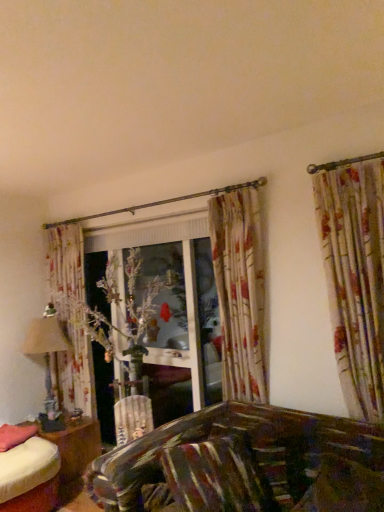
Question: Is wooden table at lower left not within matte beige lampshade at left?

Choices:
 (A) yes
 (B) no

Answer: (A)

Question: Is the depth of wooden table at lower left greater than that of matte beige lampshade at left?

Choices:
 (A) yes
 (B) no

Answer: (B)

Question: Is the position of wooden table at lower left less distant than that of matte beige lampshade at left?

Choices:
 (A) yes
 (B) no

Answer: (A)

Question: Is wooden table at lower left looking in the opposite direction of matte beige lampshade at left?

Choices:
 (A) yes
 (B) no

Answer: (B)

Question: Is wooden table at lower left to the left of matte beige lampshade at left from the viewer's perspective?

Choices:
 (A) no
 (B) yes

Answer: (A)

Question: In terms of size, does pink fabric pillow at lower left, which is the first pillow in back-to-front order, appear bigger or smaller than striped fabric pillow at lower center, marked as the 1th pillow in a front-to-back arrangement?

Choices:
 (A) small
 (B) big

Answer: (A)

Question: From a real-world perspective, is pink fabric pillow at lower left, which is counted as the 1th pillow, starting from the left, physically located above or below striped fabric pillow at lower center, marked as the 1th pillow in a front-to-back arrangement?

Choices:
 (A) above
 (B) below

Answer: (B)

Question: Is point (28, 424) positioned closer to the camera than point (221, 509)?

Choices:
 (A) closer
 (B) farther

Answer: (B)

Question: Looking at their shapes, would you say pink fabric pillow at lower left, which is the 2th pillow in front-to-back order, is wider or thinner than striped fabric pillow at lower center, marked as the second pillow in a back-to-front arrangement?

Choices:
 (A) wide
 (B) thin

Answer: (A)

Question: Considering the positions of wooden table at lower left and striped fabric pillow at lower center, marked as the second pillow in a back-to-front arrangement, in the image, is wooden table at lower left taller or shorter than striped fabric pillow at lower center, marked as the second pillow in a back-to-front arrangement,?

Choices:
 (A) short
 (B) tall

Answer: (A)

Question: Considering the positions of point (72, 457) and point (193, 475), is point (72, 457) closer or farther from the camera than point (193, 475)?

Choices:
 (A) closer
 (B) farther

Answer: (B)

Question: From a real-world perspective, is wooden table at lower left positioned above or below striped fabric pillow at lower center, the first pillow when ordered from right to left?

Choices:
 (A) above
 (B) below

Answer: (B)

Question: Is wooden table at lower left situated inside striped fabric pillow at lower center, marked as the second pillow in a back-to-front arrangement, or outside?

Choices:
 (A) outside
 (B) inside

Answer: (A)

Question: Is matte beige lampshade at left inside the boundaries of wooden table at lower left, or outside?

Choices:
 (A) outside
 (B) inside

Answer: (A)

Question: Relative to wooden table at lower left, is matte beige lampshade at left in front or behind?

Choices:
 (A) behind
 (B) front

Answer: (A)